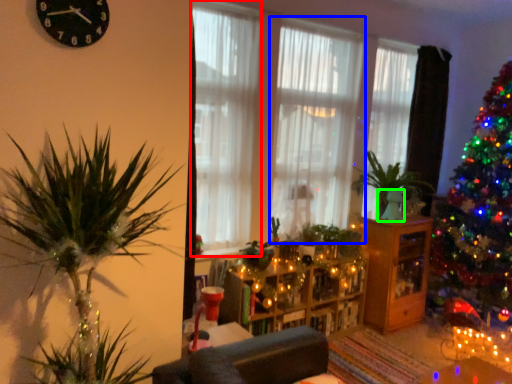
Question: Which object is positioned farthest from curtain (highlighted by a red box)? Select from curtain (highlighted by a blue box) and glass vase (highlighted by a green box).

Choices:
 (A) curtain
 (B) glass vase

Answer: (B)